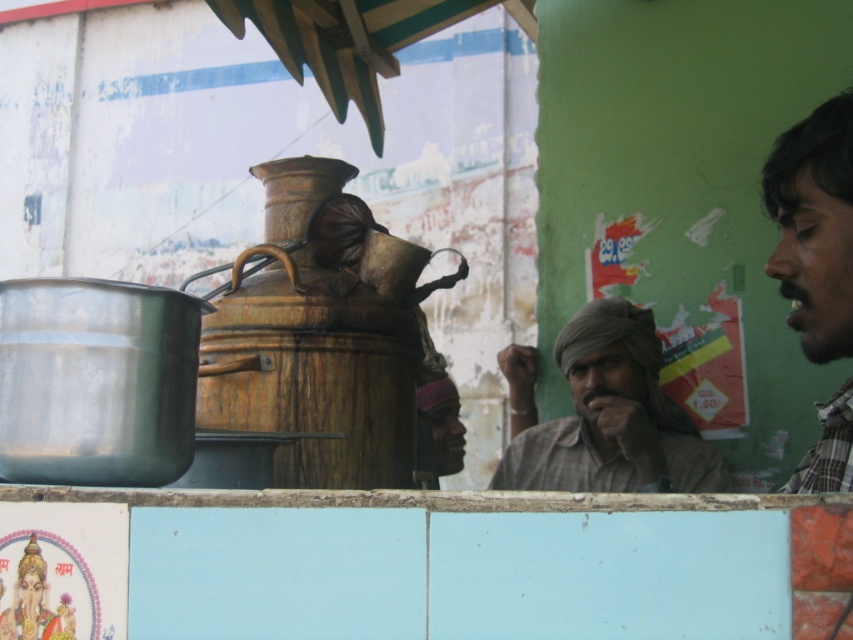
Does brown textured shirt at center appear over dark brown plaid shirt at right?

Incorrect, brown textured shirt at center is not positioned above dark brown plaid shirt at right.

Looking at this image, is brown textured shirt at center to the right of dark brown plaid shirt at right from the viewer's perspective?

No, brown textured shirt at center is not to the right of dark brown plaid shirt at right.

Is point (585, 365) in front of point (802, 298)?

No, (585, 365) is further to viewer.

This screenshot has height=640, width=853. Identify the location of brown textured shirt at center. (604, 413).